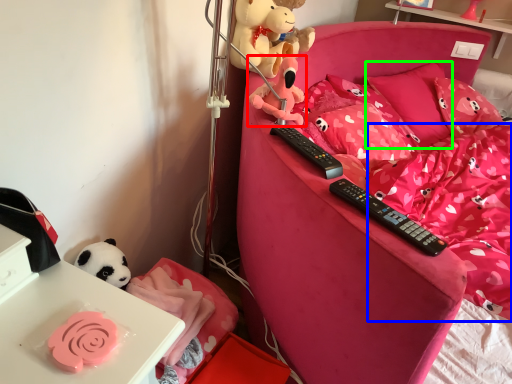
Question: Estimate the real-world distances between objects in this image. Which object is farther from toy (highlighted by a red box), bedding (highlighted by a blue box) or pillow (highlighted by a green box)?

Choices:
 (A) bedding
 (B) pillow

Answer: (B)